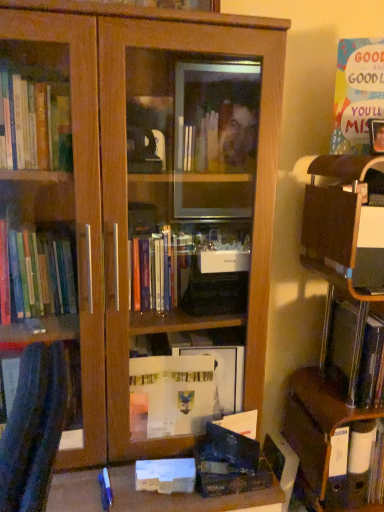
Question: Is wooden bookcase at center outside matte black paperback book at lower center, the second paperback book positioned from the top?

Choices:
 (A) yes
 (B) no

Answer: (A)

Question: Is the position of wooden bookcase at center more distant than that of matte black paperback book at lower center, the 2th paperback book in the right-to-left sequence?

Choices:
 (A) no
 (B) yes

Answer: (A)

Question: Could you tell me if wooden bookcase at center is facing matte black paperback book at lower center, positioned as the second paperback book in bottom-to-top order?

Choices:
 (A) no
 (B) yes

Answer: (B)

Question: Can matte black paperback book at lower center, the 2th paperback book when ordered from left to right, be found inside wooden bookcase at center?

Choices:
 (A) no
 (B) yes

Answer: (B)

Question: From a real-world perspective, is wooden bookcase at center located higher than matte black paperback book at lower center, positioned as the second paperback book in bottom-to-top order?

Choices:
 (A) no
 (B) yes

Answer: (B)

Question: From the image's perspective, is wooden bookcase at center located beneath matte black paperback book at lower center, the 2th paperback book in the right-to-left sequence?

Choices:
 (A) no
 (B) yes

Answer: (A)

Question: Does metallic silver book at right have a greater width compared to white matte paperback book at lower center, which is the first paperback book in bottom-to-top order?

Choices:
 (A) yes
 (B) no

Answer: (A)

Question: Does metallic silver book at right appear on the right side of white matte paperback book at lower center, which is the 3th paperback book from right to left?

Choices:
 (A) yes
 (B) no

Answer: (A)

Question: Is metallic silver book at right in front of white matte paperback book at lower center, which ranks as the third paperback book in top-to-bottom order?

Choices:
 (A) yes
 (B) no

Answer: (B)

Question: From the image's perspective, would you say metallic silver book at right is positioned over white matte paperback book at lower center, which is the 1th paperback book from left to right?

Choices:
 (A) no
 (B) yes

Answer: (B)

Question: Does metallic silver book at right have a smaller size compared to white matte paperback book at lower center, which is the first paperback book in bottom-to-top order?

Choices:
 (A) yes
 (B) no

Answer: (B)

Question: Considering the relative sizes of metallic silver book at right and white matte paperback book at lower center, which is the first paperback book in bottom-to-top order, in the image provided, is metallic silver book at right taller than white matte paperback book at lower center, which is the first paperback book in bottom-to-top order,?

Choices:
 (A) yes
 (B) no

Answer: (A)

Question: Would you say metallic silver book at right is outside matte black paperback book at lower center, the 2th paperback book when ordered from left to right?

Choices:
 (A) yes
 (B) no

Answer: (A)